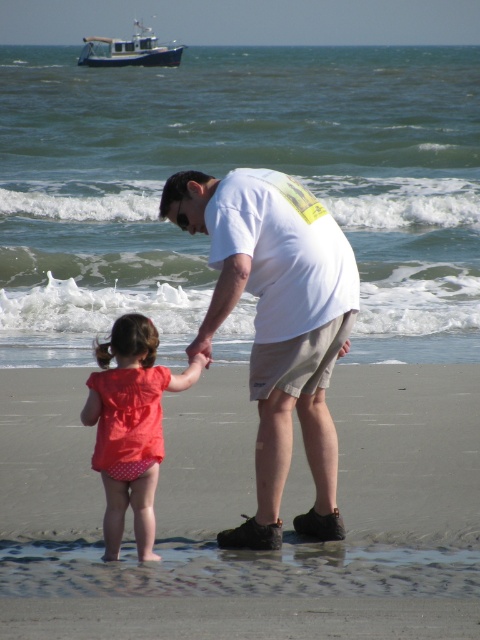
Consider the image. Which is above, white matte shirt at center or polka dot fabric swimsuit at lower left?

white matte shirt at center is above.

Is white matte shirt at center smaller than polka dot fabric swimsuit at lower left?

No.

The image size is (480, 640). In order to click on white matte shirt at center in this screenshot , I will do `click(276, 324)`.

Is point (249, 538) farther from viewer compared to point (88, 44)?

No, (249, 538) is closer to viewer.

Find the location of a particular element. Image resolution: width=480 pixels, height=640 pixels. white matte shirt at center is located at coordinates (276, 324).

Can you confirm if polka dot fabric swimsuit at lower left is smaller than wooden boat at upper left?

Yes.

Does polka dot fabric swimsuit at lower left have a lesser width compared to wooden boat at upper left?

Indeed, polka dot fabric swimsuit at lower left has a lesser width compared to wooden boat at upper left.

Does point (93, 413) come in front of point (146, 33)?

That is True.

At what (x,y) coordinates should I click in order to perform the action: click on polka dot fabric swimsuit at lower left. Please return your answer as a coordinate pair (x, y). The width and height of the screenshot is (480, 640). Looking at the image, I should click on (131, 426).